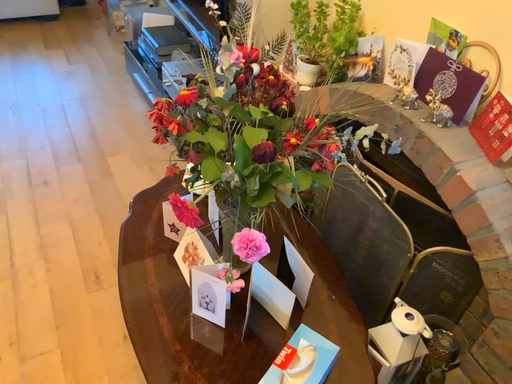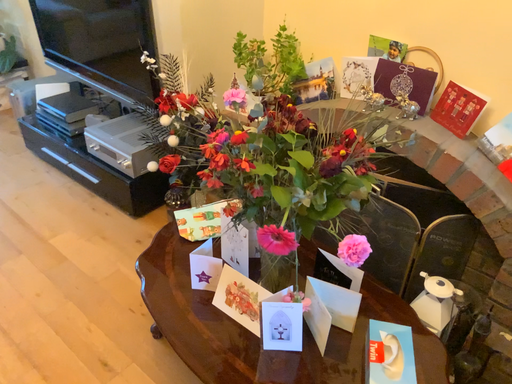
Question: Which way did the camera rotate in the video?

Choices:
 (A) rotated left
 (B) rotated right

Answer: (B)